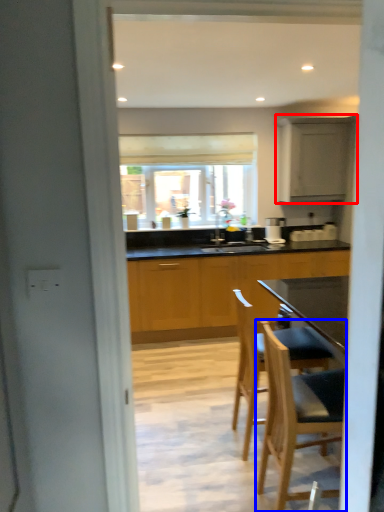
Question: Which point is further to the camera, cabinetry (highlighted by a red box) or chair (highlighted by a blue box)?

Choices:
 (A) cabinetry
 (B) chair

Answer: (A)